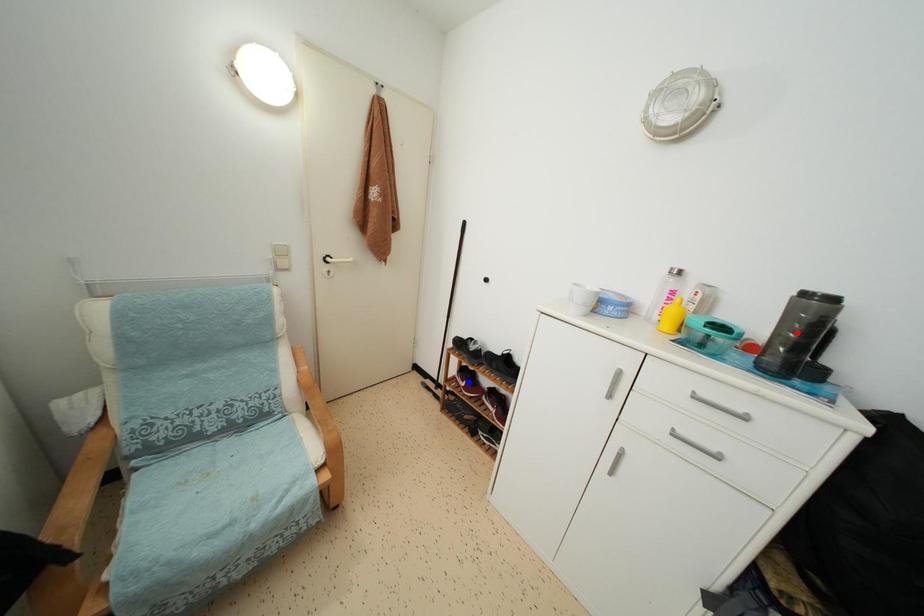
Question: Two points are marked on the image. Which point is closer to the camera?

Choices:
 (A) Blue point is closer.
 (B) Red point is closer.

Answer: (B)